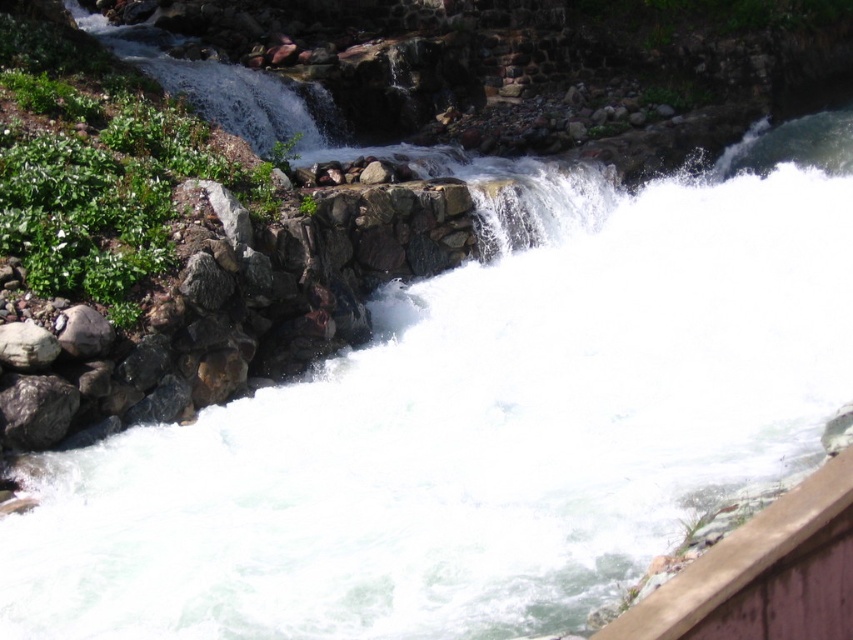
Question: Is brown wooden ledge at lower right to the right of gray rough rock at left from the viewer's perspective?

Choices:
 (A) no
 (B) yes

Answer: (B)

Question: Does brown wooden ledge at lower right appear on the left side of gray rough rock at left?

Choices:
 (A) no
 (B) yes

Answer: (A)

Question: Among these objects, which one is nearest to the camera?

Choices:
 (A) gray rough rock at left
 (B) brown wooden ledge at lower right

Answer: (B)

Question: Which point is closer to the camera?

Choices:
 (A) (769, 627)
 (B) (4, 332)

Answer: (A)

Question: Does brown wooden ledge at lower right appear over gray rough rock at left?

Choices:
 (A) yes
 (B) no

Answer: (B)

Question: Which point appears closest to the camera in this image?

Choices:
 (A) (38, 355)
 (B) (706, 611)

Answer: (B)